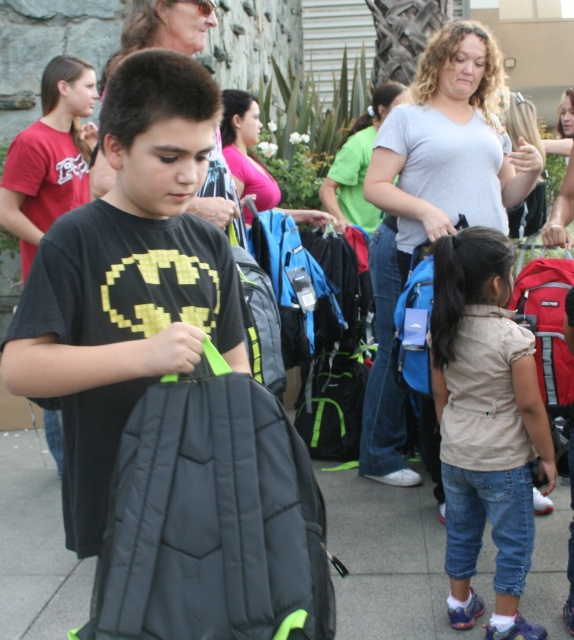
Based on the coordinates provided, where is the black quilted backpack at center located in the image?

The black quilted backpack at center is located at the coordinates point (212, 518).

You are a photographer trying to capture a candid shot of the black quilted backpack at center and the matte black hair at upper center. Based on their sizes, which object would appear larger in your photo?

The matte black hair at upper center would appear larger in the photo since it is larger than the black quilted backpack at center.

You are a photographer trying to capture a candid shot of the gray cotton shirt at upper center without including the black quilted backpack at center in the frame. Based on their positions, is this possible? Explain your reasoning.

The black quilted backpack at center is to the left of the gray cotton shirt at upper center. Since the backpack is positioned to the left of the shirt, you can adjust your angle to focus on the gray cotton shirt at upper center while avoiding the backpack by moving your camera to the right side of the backpack.